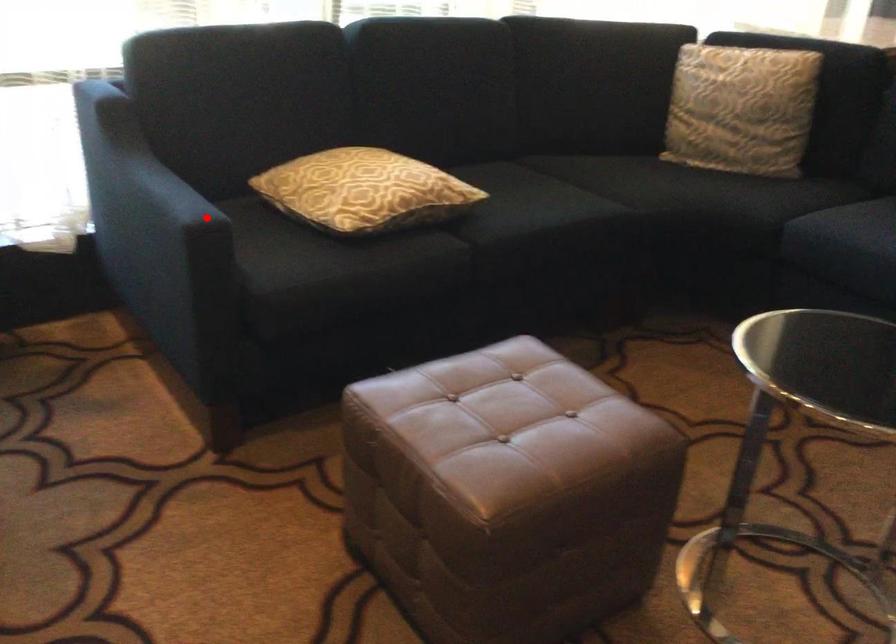
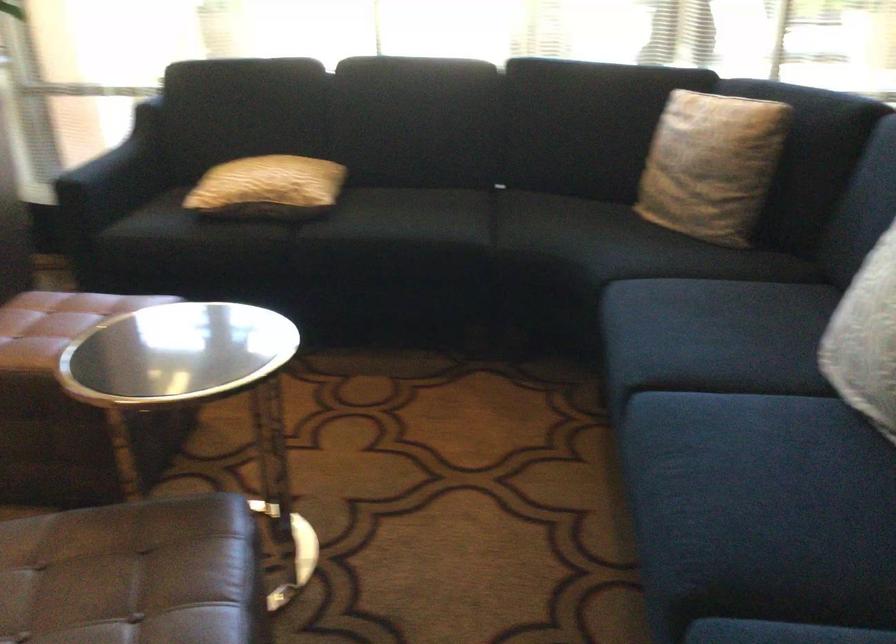
Find the pixel in the second image that matches the highlighted location in the first image.

(115, 176)